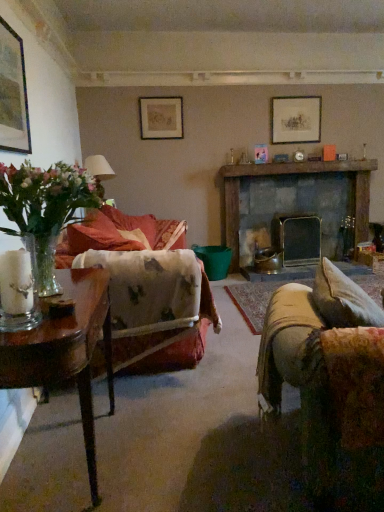
The width and height of the screenshot is (384, 512). What do you see at coordinates (99, 170) in the screenshot? I see `matte white lampshade at left` at bounding box center [99, 170].

Find the location of a particular element. The width and height of the screenshot is (384, 512). velvet floral pillow at center is located at coordinates (133, 222).

Locate an element on the screen. matte gold picture frame at upper center, the second picture frame positioned from the back is located at coordinates (161, 118).

At what (x,y) coordinates should I click in order to perform the action: click on rustic wooden mantle at upper center. Please return your answer as a coordinate pair (x, y). This screenshot has height=512, width=384. Looking at the image, I should click on (297, 168).

Does point (128, 220) come farther from viewer compared to point (339, 222)?

No.

Are velvet floral pillow at center and dark gray stone fireplace at center located far from each other?

Indeed, velvet floral pillow at center is not near dark gray stone fireplace at center.

Can you confirm if velvet floral pillow at center is wider than dark gray stone fireplace at center?

Correct, the width of velvet floral pillow at center exceeds that of dark gray stone fireplace at center.

In the scene shown: Is velvet floral pillow at center smaller than dark gray stone fireplace at center?

Yes.

In the image, there is a clear glass vase at left. Identify the location of fireplace below it (from a real-world perspective). Image resolution: width=384 pixels, height=512 pixels. (292, 200).

Is clear glass vase at left smaller than dark gray stone fireplace at center?

Yes.

Considering the sizes of objects clear glass vase at left and dark gray stone fireplace at center in the image provided, who is shorter, clear glass vase at left or dark gray stone fireplace at center?

With less height is clear glass vase at left.

Is matte black picture frame at upper left, which ranks as the 1th picture frame in left-to-right order, shorter than clear glass vase at left?

In fact, matte black picture frame at upper left, which ranks as the 1th picture frame in left-to-right order, may be taller than clear glass vase at left.

Can you confirm if matte black picture frame at upper left, which is counted as the 3th picture frame, starting from the right, is positioned to the right of clear glass vase at left?

Incorrect, matte black picture frame at upper left, which is counted as the 3th picture frame, starting from the right, is not on the right side of clear glass vase at left.

From a real-world perspective, which object rests below the other?

In real-world perspective, clear glass vase at left is lower.

Considering the sizes of matte black picture frame at upper left, which is counted as the 1th picture frame, starting from the front, and clear glass vase at left in the image, is matte black picture frame at upper left, which is counted as the 1th picture frame, starting from the front, wider or thinner than clear glass vase at left?

Clearly, matte black picture frame at upper left, which is counted as the 1th picture frame, starting from the front, has less width compared to clear glass vase at left.

Visually, is matte black picture frame at upper left, which is counted as the 3th picture frame, starting from the right, positioned to the left or to the right of matte gold picture frame at upper center, which is counted as the second picture frame, starting from the left?

matte black picture frame at upper left, which is counted as the 3th picture frame, starting from the right, is to the left of matte gold picture frame at upper center, which is counted as the second picture frame, starting from the left.

Considering the relative positions of matte black picture frame at upper left, which is counted as the 3th picture frame, starting from the right, and matte gold picture frame at upper center, which is counted as the second picture frame, starting from the front, in the image provided, is matte black picture frame at upper left, which is counted as the 3th picture frame, starting from the right, behind matte gold picture frame at upper center, which is counted as the second picture frame, starting from the front,?

No, it is in front of matte gold picture frame at upper center, which is counted as the second picture frame, starting from the front.

Image resolution: width=384 pixels, height=512 pixels. What are the coordinates of `picture frame in front of the matte gold picture frame at upper center, placed as the 2th picture frame when sorted from right to left` in the screenshot? It's located at (13, 93).

Which object is thinner, matte black picture frame at upper left, which is the third picture frame from back to front, or matte gold picture frame at upper center, the second picture frame positioned from the back?

Thinner between the two is matte gold picture frame at upper center, the second picture frame positioned from the back.

From the picture: Is wooden table at left taller or shorter than matte silver picture frame at upper center, which is the 1th picture frame in right-to-left order?

wooden table at left is taller than matte silver picture frame at upper center, which is the 1th picture frame in right-to-left order.

Are wooden table at left and matte silver picture frame at upper center, marked as the 3th picture frame in a left-to-right arrangement, located far from each other?

Absolutely, wooden table at left is distant from matte silver picture frame at upper center, marked as the 3th picture frame in a left-to-right arrangement.

The width and height of the screenshot is (384, 512). Find the location of `table beneath the matte silver picture frame at upper center, acting as the 3th picture frame starting from the front (from a real-world perspective)`. table beneath the matte silver picture frame at upper center, acting as the 3th picture frame starting from the front (from a real-world perspective) is located at coordinates (66, 352).

Measure the distance from wooden table at left to matte silver picture frame at upper center, acting as the 1th picture frame starting from the back.

wooden table at left and matte silver picture frame at upper center, acting as the 1th picture frame starting from the back, are 11.72 feet apart.

Visually, is matte white lampshade at left positioned to the left or to the right of velvet floral-patterned couch at left?

matte white lampshade at left is positioned on velvet floral-patterned couch at left's left side.

Is point (95, 159) closer or farther from the camera than point (95, 231)?

Point (95, 159) is farther from the camera than point (95, 231).

Find the location of a particular element. The width and height of the screenshot is (384, 512). studio couch in front of the matte white lampshade at left is located at coordinates [x=146, y=288].

Is matte white lampshade at left in front of or behind velvet floral-patterned couch at left in the image?

In the image, matte white lampshade at left appears behind velvet floral-patterned couch at left.

Is wooden table at left spatially inside dark gray stone fireplace at center, or outside of it?

wooden table at left is outside dark gray stone fireplace at center.

Considering the positions of objects wooden table at left and dark gray stone fireplace at center in the image provided, who is behind, wooden table at left or dark gray stone fireplace at center?

dark gray stone fireplace at center is further from the camera.

Which of these two, wooden table at left or dark gray stone fireplace at center, is smaller?

Smaller between the two is wooden table at left.

You are a GUI agent. You are given a task and a screenshot of the screen. Output one action in this format:
    pyautogui.click(x=<x>, y=<y>)
    Task: Click on the pillow in front of the dark gray stone fireplace at center
    This screenshot has height=512, width=384.
    Given the screenshot: What is the action you would take?
    pyautogui.click(x=133, y=222)

This screenshot has height=512, width=384. What are the coordinates of `houseplant below the dark gray stone fireplace at center (from the image's perspective)` in the screenshot? It's located at (45, 210).

When comparing their distances from matte white lampshade at left, does clear glass vase at left or dark gray stone fireplace at center seem closer?

dark gray stone fireplace at center.

When comparing their distances from matte black picture frame at upper left, which ranks as the 1th picture frame in left-to-right order, does velvet floral pillow at center or matte gold picture frame at upper center, placed as the 2th picture frame when sorted from right to left, seem closer?

Based on the image, velvet floral pillow at center appears to be nearer to matte black picture frame at upper left, which ranks as the 1th picture frame in left-to-right order.

From the image, which object appears to be farther from dark gray stone fireplace at center, velvet floral pillow at center or matte gold picture frame at upper center, which is counted as the second picture frame, starting from the left?

Among the two, velvet floral pillow at center is located further to dark gray stone fireplace at center.

Looking at the image, which one is located closer to clear glass vase at left, matte silver picture frame at upper center, acting as the 1th picture frame starting from the back, or dark gray stone fireplace at center?

dark gray stone fireplace at center.

When comparing their distances from velvet floral pillow at center, does matte gold picture frame at upper center, the second picture frame positioned from the back, or matte silver picture frame at upper center, acting as the 1th picture frame starting from the back, seem closer?

Based on the image, matte gold picture frame at upper center, the second picture frame positioned from the back, appears to be nearer to velvet floral pillow at center.

Looking at the image, which one is located further to matte silver picture frame at upper center, marked as the 3th picture frame in a left-to-right arrangement, rustic wooden mantle at upper center or dark gray stone fireplace at center?

dark gray stone fireplace at center lies further to matte silver picture frame at upper center, marked as the 3th picture frame in a left-to-right arrangement, than the other object.

When comparing their distances from rustic wooden mantle at upper center, does matte black picture frame at upper left, which is counted as the 1th picture frame, starting from the front, or dark gray stone fireplace at center seem further?

Based on the image, matte black picture frame at upper left, which is counted as the 1th picture frame, starting from the front, appears to be further to rustic wooden mantle at upper center.

From the image, which object appears to be nearer to dark gray stone fireplace at center, matte white lampshade at left or clear glass vase at left?

matte white lampshade at left is closer to dark gray stone fireplace at center.

Find the location of `lamp between clear glass vase at left and dark gray stone fireplace at center in the front-back direction`. lamp between clear glass vase at left and dark gray stone fireplace at center in the front-back direction is located at coordinates (x=99, y=170).

Identify the location of fireplace between matte black picture frame at upper left, which is counted as the 1th picture frame, starting from the front, and matte silver picture frame at upper center, marked as the 3th picture frame in a left-to-right arrangement, along the z-axis. (292, 200).

Locate an element on the screen. The width and height of the screenshot is (384, 512). lamp located between clear glass vase at left and matte gold picture frame at upper center, placed as the 2th picture frame when sorted from right to left, in the depth direction is located at coordinates (99, 170).

Identify the location of studio couch between clear glass vase at left and matte white lampshade at left along the z-axis. (146, 288).